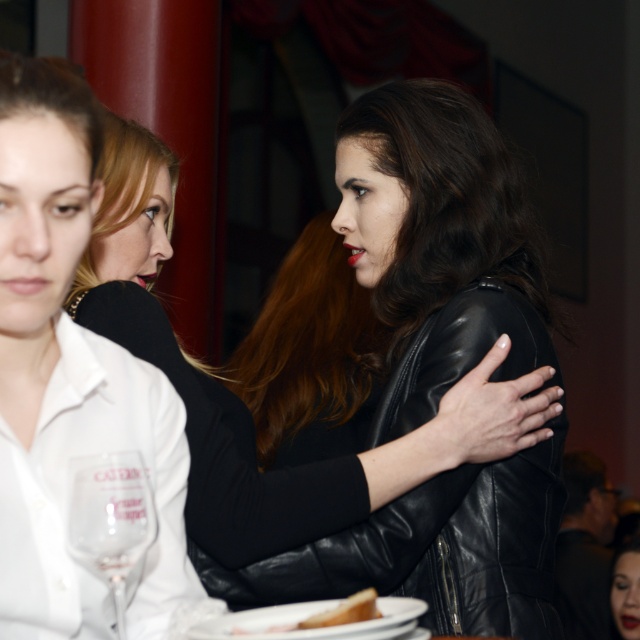
Which of these two, transparent glass at lower left or white bread at lower center, stands taller?

Standing taller between the two is transparent glass at lower left.

In the scene shown: Who is lower down, transparent glass at lower left or white bread at lower center?

white bread at lower center is lower down.

Is point (118, 577) closer to viewer compared to point (298, 621)?

Yes, point (118, 577) is in front of point (298, 621).

Where is `transparent glass at lower left`? transparent glass at lower left is located at coordinates (109, 518).

Which is above, black leather jacket at center or transparent glass at lower left?

black leather jacket at center

Can you confirm if black leather jacket at center is positioned to the right of transparent glass at lower left?

Yes, black leather jacket at center is to the right of transparent glass at lower left.

The width and height of the screenshot is (640, 640). Identify the location of black leather jacket at center. (227, 388).

Does matte black jacket at upper center appear on the left side of black leather jacket at center?

Yes, matte black jacket at upper center is to the left of black leather jacket at center.

Does point (164, 566) come behind point (390, 486)?

No.

Is point (51, 236) less distant than point (115, 202)?

Yes, point (51, 236) is closer to viewer.

Find the location of a particular element. The height and width of the screenshot is (640, 640). matte black jacket at upper center is located at coordinates (68, 380).